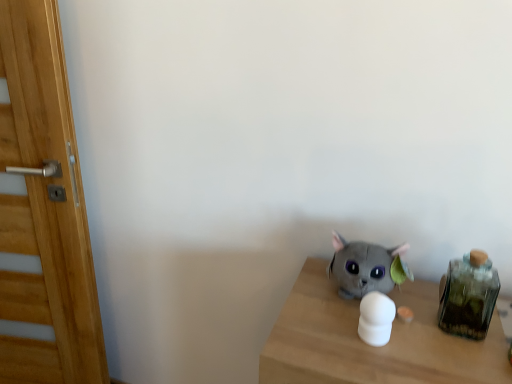
Question: Is green glass jar at right oriented towards white matte object at center, the second toy viewed from the back?

Choices:
 (A) no
 (B) yes

Answer: (A)

Question: Is white matte object at center, the second toy viewed from the back, at the back of green glass jar at right?

Choices:
 (A) no
 (B) yes

Answer: (A)

Question: From the image's perspective, does green glass jar at right appear higher than white matte object at center, which is counted as the first toy, starting from the front?

Choices:
 (A) yes
 (B) no

Answer: (A)

Question: Is green glass jar at right far from white matte object at center, which is counted as the first toy, starting from the front?

Choices:
 (A) yes
 (B) no

Answer: (B)

Question: Can you confirm if green glass jar at right is positioned to the right of white matte object at center, the second toy viewed from the back?

Choices:
 (A) yes
 (B) no

Answer: (A)

Question: Is green glass jar at right to the left of white matte object at center, the second toy viewed from the back, from the viewer's perspective?

Choices:
 (A) yes
 (B) no

Answer: (B)

Question: Does white matte object at center, which is counted as the first toy, starting from the front, have a greater height compared to green glass jar at right?

Choices:
 (A) no
 (B) yes

Answer: (A)

Question: Can you see white matte object at center, the second toy viewed from the back, touching green glass jar at right?

Choices:
 (A) no
 (B) yes

Answer: (A)

Question: Is the depth of white matte object at center, which is counted as the first toy, starting from the front, less than that of green glass jar at right?

Choices:
 (A) yes
 (B) no

Answer: (A)

Question: Does white matte object at center, the second toy viewed from the back, have a larger size compared to green glass jar at right?

Choices:
 (A) no
 (B) yes

Answer: (A)

Question: From a real-world perspective, is white matte object at center, which is counted as the first toy, starting from the front, physically above green glass jar at right?

Choices:
 (A) yes
 (B) no

Answer: (B)

Question: Is white matte object at center, the second toy viewed from the back, oriented away from green glass jar at right?

Choices:
 (A) no
 (B) yes

Answer: (A)

Question: Is there a large distance between soft gray plush cat at center, arranged as the 2th toy when viewed from the front, and green glass jar at right?

Choices:
 (A) yes
 (B) no

Answer: (B)